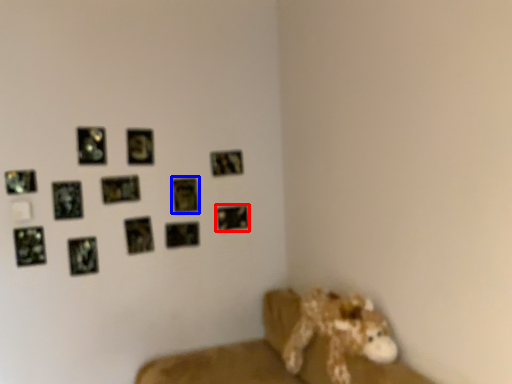
Question: Which point is closer to the camera, picture frame (highlighted by a red box) or picture frame (highlighted by a blue box)?

Choices:
 (A) picture frame
 (B) picture frame

Answer: (B)